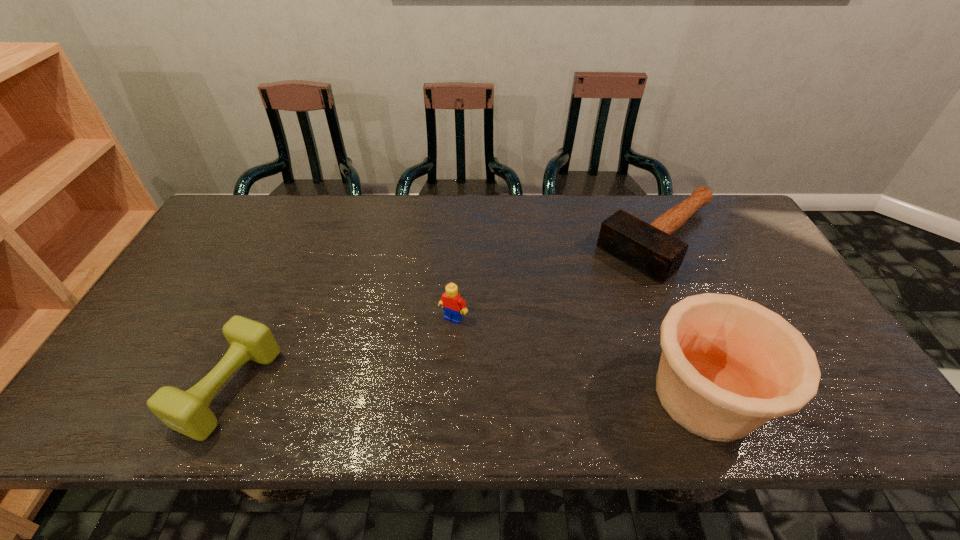
At what (x,y) coordinates should I click in order to perform the action: click on vacant space at the far left corner of the desktop. Please return your answer as a coordinate pair (x, y). Looking at the image, I should click on (269, 208).

Identify the location of free spot at the far right corner of the desktop. The image size is (960, 540). (705, 239).

Find the location of a particular element. The height and width of the screenshot is (540, 960). vacant area that lies between the leftmost object and the second object from left to right is located at coordinates (342, 353).

The width and height of the screenshot is (960, 540). Identify the location of free spot between the mallet and the third nearest object. (557, 279).

This screenshot has width=960, height=540. What are the coordinates of `vacant space that's between the leftmost object and the second object from left to right` in the screenshot? It's located at tap(342, 353).

This screenshot has width=960, height=540. In order to click on free spot between the third object from right to left and the mallet in this screenshot , I will do `click(557, 279)`.

The width and height of the screenshot is (960, 540). In order to click on empty space that is in between the tallest object and the dumbbell in this screenshot , I will do `click(468, 392)`.

Identify the location of free point between the farthest object and the third nearest object. Image resolution: width=960 pixels, height=540 pixels. point(557,279).

Find the location of a particular element. blank region between the second object from left to right and the farthest object is located at coordinates (557, 279).

Where is `object that ranks as the closest to the dumbbell`? object that ranks as the closest to the dumbbell is located at coordinates (454, 306).